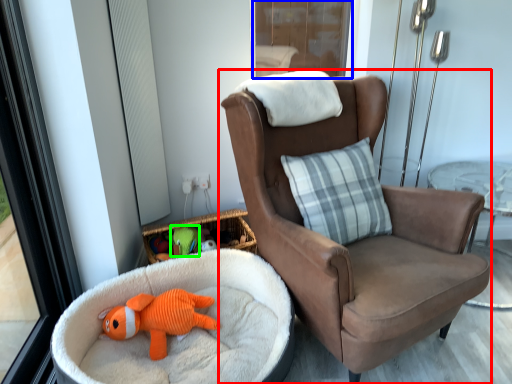
Question: Which object is positioned closest to chair (highlighted by a red box)? Select from screen door (highlighted by a blue box) and toy (highlighted by a green box).

Choices:
 (A) screen door
 (B) toy

Answer: (B)